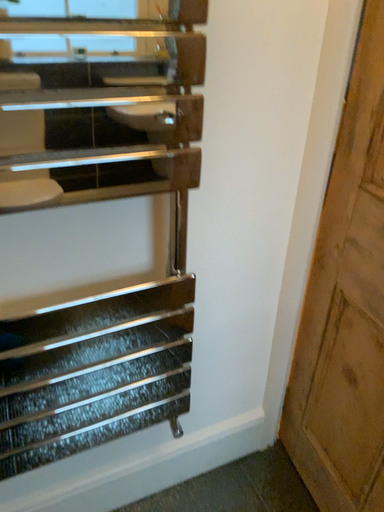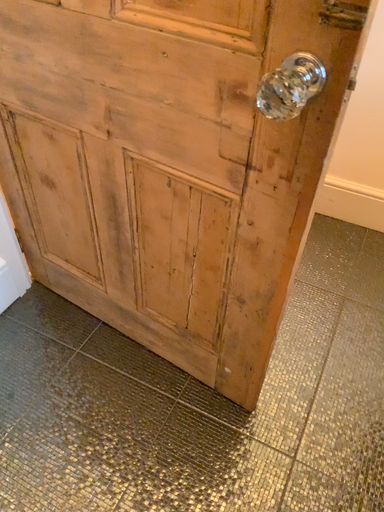
Question: Which way did the camera rotate in the video?

Choices:
 (A) rotated left
 (B) rotated right

Answer: (B)